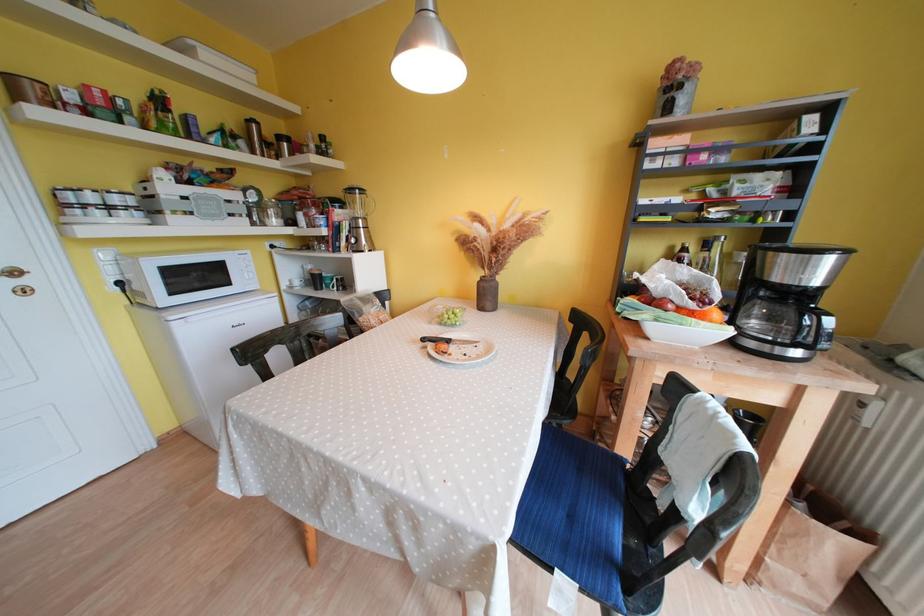
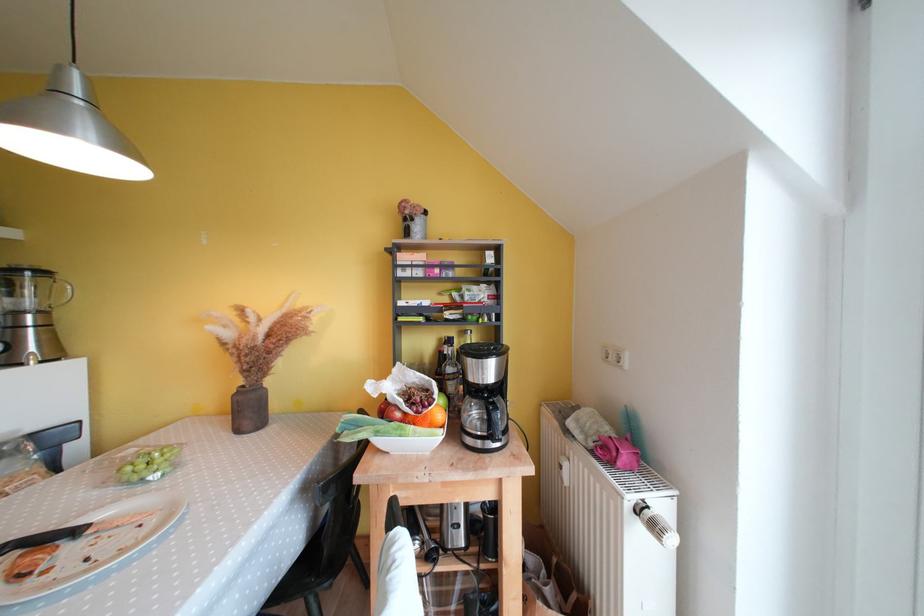
Find the pixel in the second image that matches the point at 709,307 in the first image.

(431, 411)